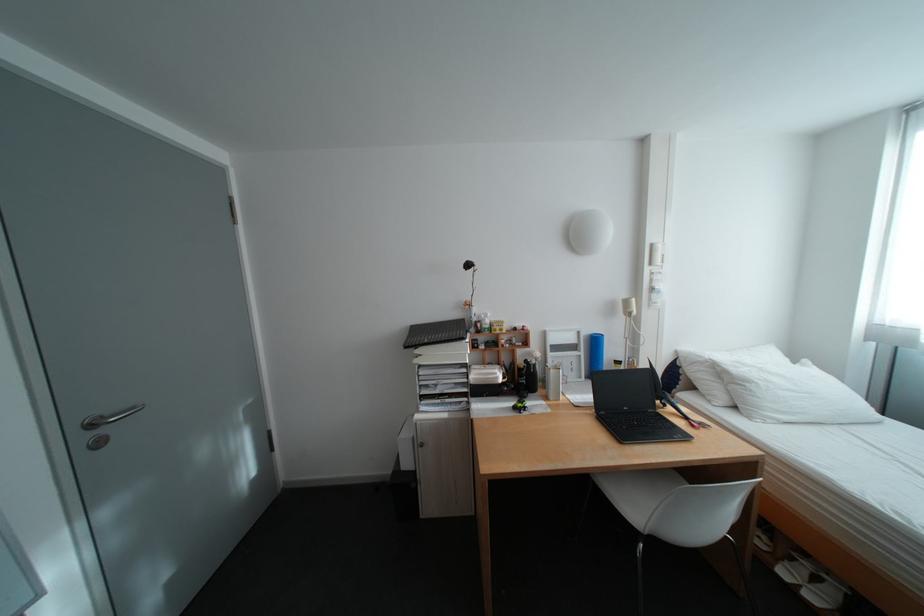
In order to click on white paper tray in this screenshot , I will do `click(484, 374)`.